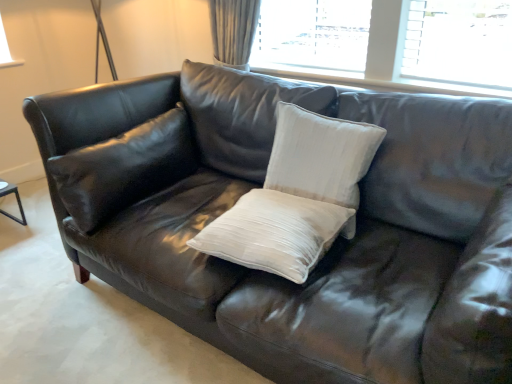
The image size is (512, 384). What do you see at coordinates (124, 168) in the screenshot?
I see `matte black pillow at left, placed as the 3th pillow when sorted from right to left` at bounding box center [124, 168].

In order to click on white satin pillow at center, the second pillow from the left in this screenshot , I will do `click(275, 233)`.

The image size is (512, 384). What are the coordinates of `matte black pillow at left, positioned as the first pillow in left-to-right order` in the screenshot? It's located at (124, 168).

From a real-world perspective, count 2nd pillows downward from the white textured pillow at center, the 1th pillow positioned from the right, and point to it. Please provide its 2D coordinates.

[(275, 233)]

Looking at this image, is white textured pillow at center, the 1th pillow positioned from the right, positioned before white satin pillow at center, the 2th pillow positioned from the right?

No, the depth of white textured pillow at center, the 1th pillow positioned from the right, is greater than that of white satin pillow at center, the 2th pillow positioned from the right.

Which is nearer, (274, 163) or (285, 229)?

Point (274, 163) is positioned farther from the camera compared to point (285, 229).

Is white satin pillow at center, the 2th pillow positioned from the right, in front of white textured pillow at center, which ranks as the 3th pillow in left-to-right order?

Yes, white satin pillow at center, the 2th pillow positioned from the right, is in front of white textured pillow at center, which ranks as the 3th pillow in left-to-right order.

Is white textured pillow at center, the 1th pillow positioned from the right, inside white satin pillow at center, the second pillow from the left?

No, white textured pillow at center, the 1th pillow positioned from the right, is not surrounded by white satin pillow at center, the second pillow from the left.

Which of these two, white satin pillow at center, the second pillow from the left, or white textured pillow at center, the 1th pillow positioned from the right, is wider?

white satin pillow at center, the second pillow from the left.

Between white satin pillow at center, the 2th pillow positioned from the right, and white textured pillow at center, the 1th pillow positioned from the right, which one has more height?

white textured pillow at center, the 1th pillow positioned from the right, is taller.

Which of these two, white textured pillow at center, the 1th pillow positioned from the right, or matte black pillow at left, placed as the 3th pillow when sorted from right to left, is wider?

With larger width is matte black pillow at left, placed as the 3th pillow when sorted from right to left.

The height and width of the screenshot is (384, 512). Identify the location of pillow that is the 1st object directly below the white textured pillow at center, the 1th pillow positioned from the right (from a real-world perspective). (124, 168).

What's the angular difference between white textured pillow at center, the 1th pillow positioned from the right, and matte black pillow at left, positioned as the first pillow in left-to-right order,'s facing directions?

They differ by 90 degrees in their facing directions.

Considering the positions of objects matte black pillow at left, placed as the 3th pillow when sorted from right to left, and white satin pillow at center, the 2th pillow positioned from the right, in the image provided, who is more to the right, matte black pillow at left, placed as the 3th pillow when sorted from right to left, or white satin pillow at center, the 2th pillow positioned from the right,?

Positioned to the right is white satin pillow at center, the 2th pillow positioned from the right.

Based on the photo, considering the relative positions of matte black pillow at left, positioned as the first pillow in left-to-right order, and white satin pillow at center, the 2th pillow positioned from the right, in the image provided, is matte black pillow at left, positioned as the first pillow in left-to-right order, in front of white satin pillow at center, the 2th pillow positioned from the right,?

That is False.

How many degrees apart are the facing directions of matte black pillow at left, placed as the 3th pillow when sorted from right to left, and white satin pillow at center, the second pillow from the left?

The facing directions of matte black pillow at left, placed as the 3th pillow when sorted from right to left, and white satin pillow at center, the second pillow from the left, are 90 degrees apart.

Which of these two, matte black pillow at left, positioned as the first pillow in left-to-right order, or white satin pillow at center, the second pillow from the left, is bigger?

matte black pillow at left, positioned as the first pillow in left-to-right order, is bigger.

Considering the positions of objects white satin pillow at center, the second pillow from the left, and matte black pillow at left, placed as the 3th pillow when sorted from right to left, in the image provided, who is more to the right, white satin pillow at center, the second pillow from the left, or matte black pillow at left, placed as the 3th pillow when sorted from right to left,?

Positioned to the right is white satin pillow at center, the second pillow from the left.

Is white satin pillow at center, the second pillow from the left, positioned far away from matte black pillow at left, positioned as the first pillow in left-to-right order?

Actually, white satin pillow at center, the second pillow from the left, and matte black pillow at left, positioned as the first pillow in left-to-right order, are a little close together.

Which of these two, white satin pillow at center, the 2th pillow positioned from the right, or matte black pillow at left, positioned as the first pillow in left-to-right order, is bigger?

matte black pillow at left, positioned as the first pillow in left-to-right order.

From the image's perspective, which is below, white satin pillow at center, the second pillow from the left, or matte black pillow at left, placed as the 3th pillow when sorted from right to left?

white satin pillow at center, the second pillow from the left, appears lower in the image.

Considering the relative sizes of matte black pillow at left, positioned as the first pillow in left-to-right order, and white textured pillow at center, the 1th pillow positioned from the right, in the image provided, is matte black pillow at left, positioned as the first pillow in left-to-right order, shorter than white textured pillow at center, the 1th pillow positioned from the right,?

Yes.

Is point (102, 171) positioned in front of point (376, 133)?

That is False.

Is matte black pillow at left, positioned as the first pillow in left-to-right order, at the right side of white textured pillow at center, the 1th pillow positioned from the right?

Incorrect, matte black pillow at left, positioned as the first pillow in left-to-right order, is not on the right side of white textured pillow at center, the 1th pillow positioned from the right.

Who is more distant, matte black pillow at left, placed as the 3th pillow when sorted from right to left, or white textured pillow at center, the 1th pillow positioned from the right?

matte black pillow at left, placed as the 3th pillow when sorted from right to left, is further from the camera.

Identify the location of pillow in front of the white textured pillow at center, which ranks as the 3th pillow in left-to-right order. (275, 233).

Where is `pillow that is the 2nd object directly below the white textured pillow at center, the 1th pillow positioned from the right (from a real-world perspective)`? pillow that is the 2nd object directly below the white textured pillow at center, the 1th pillow positioned from the right (from a real-world perspective) is located at coordinates (275, 233).

Looking at the image, which one is located closer to white satin pillow at center, the second pillow from the left, matte black pillow at left, positioned as the first pillow in left-to-right order, or white textured pillow at center, which ranks as the 3th pillow in left-to-right order?

white textured pillow at center, which ranks as the 3th pillow in left-to-right order, is closer to white satin pillow at center, the second pillow from the left.

Considering their positions, is white satin pillow at center, the 2th pillow positioned from the right, positioned closer to white textured pillow at center, the 1th pillow positioned from the right, than matte black pillow at left, positioned as the first pillow in left-to-right order?

Among the two, white satin pillow at center, the 2th pillow positioned from the right, is located nearer to white textured pillow at center, the 1th pillow positioned from the right.

From the image, which object appears to be nearer to white satin pillow at center, the 2th pillow positioned from the right, white textured pillow at center, which ranks as the 3th pillow in left-to-right order, or matte black pillow at left, positioned as the first pillow in left-to-right order?

white textured pillow at center, which ranks as the 3th pillow in left-to-right order, lies closer to white satin pillow at center, the 2th pillow positioned from the right, than the other object.

Considering their positions, is white satin pillow at center, the second pillow from the left, positioned further to matte black pillow at left, positioned as the first pillow in left-to-right order, than white textured pillow at center, which ranks as the 3th pillow in left-to-right order?

white textured pillow at center, which ranks as the 3th pillow in left-to-right order, is further to matte black pillow at left, positioned as the first pillow in left-to-right order.

When comparing their distances from white textured pillow at center, which ranks as the 3th pillow in left-to-right order, does matte black pillow at left, placed as the 3th pillow when sorted from right to left, or white satin pillow at center, the 2th pillow positioned from the right, seem further?

matte black pillow at left, placed as the 3th pillow when sorted from right to left.

When comparing their distances from matte black pillow at left, placed as the 3th pillow when sorted from right to left, does white textured pillow at center, which ranks as the 3th pillow in left-to-right order, or white satin pillow at center, the 2th pillow positioned from the right, seem closer?

Among the two, white satin pillow at center, the 2th pillow positioned from the right, is located nearer to matte black pillow at left, placed as the 3th pillow when sorted from right to left.

The width and height of the screenshot is (512, 384). I want to click on pillow between matte black pillow at left, positioned as the first pillow in left-to-right order, and white textured pillow at center, the 1th pillow positioned from the right, in the horizontal direction, so click(x=275, y=233).